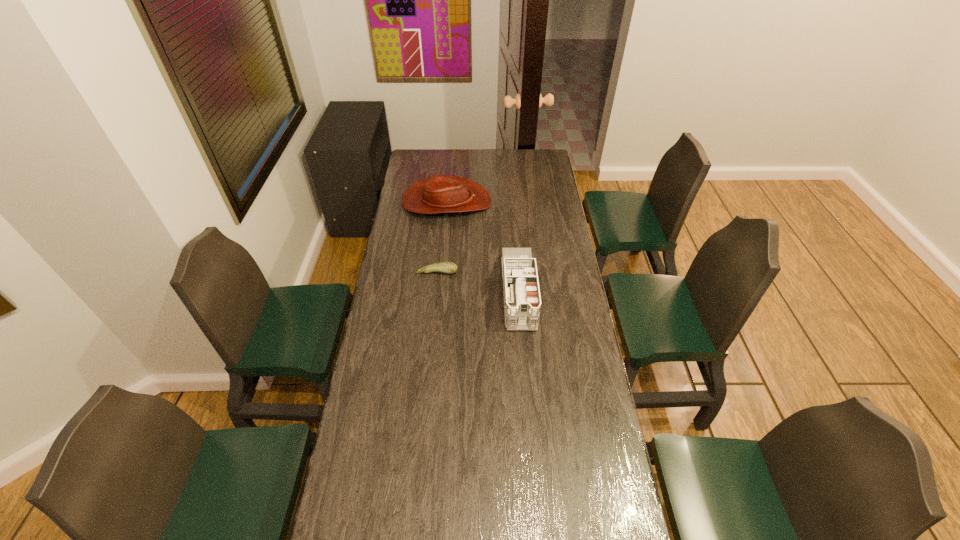
Identify the location of vacant area between the dollhouse and the second shortest object. (483, 247).

This screenshot has height=540, width=960. What are the coordinates of `vacant space in between the dollhouse and the zucchini` in the screenshot? It's located at (478, 282).

I want to click on object that can be found as the second closest to the second shortest object, so click(444, 267).

In order to click on the second closest object to the shortest object in this screenshot , I will do `click(440, 193)`.

You are a GUI agent. You are given a task and a screenshot of the screen. Output one action in this format:
    pyautogui.click(x=<x>, y=<y>)
    Task: Click on the free region that satisfies the following two spatial constraints: 1. on the front-facing side of the second shortest object; 2. at the stem end of the zucchini
    The image size is (960, 540).
    Given the screenshot: What is the action you would take?
    pyautogui.click(x=441, y=272)

The height and width of the screenshot is (540, 960). Identify the location of free space that satisfies the following two spatial constraints: 1. on the front-facing side of the farthest object; 2. at the stem end of the shortest object. pyautogui.click(x=441, y=272).

Image resolution: width=960 pixels, height=540 pixels. In order to click on free space that satisfies the following two spatial constraints: 1. on the front-facing side of the cowboy hat; 2. at the stem end of the zucchini in this screenshot , I will do `click(441, 272)`.

You are a GUI agent. You are given a task and a screenshot of the screen. Output one action in this format:
    pyautogui.click(x=<x>, y=<y>)
    Task: Click on the free space that satisfies the following two spatial constraints: 1. on the front-facing side of the cowboy hat; 2. at the stem end of the zucchini
    Image resolution: width=960 pixels, height=540 pixels.
    Given the screenshot: What is the action you would take?
    pyautogui.click(x=441, y=272)